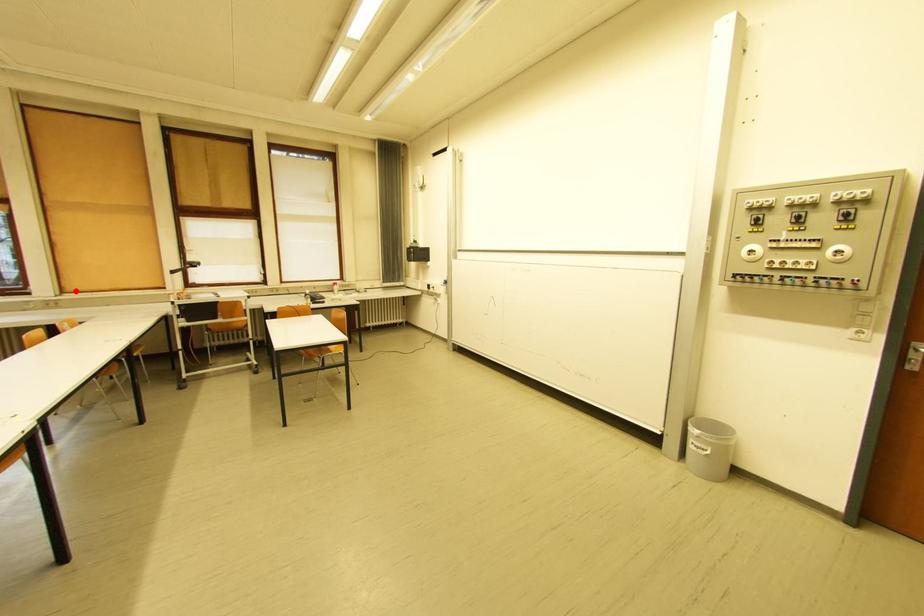
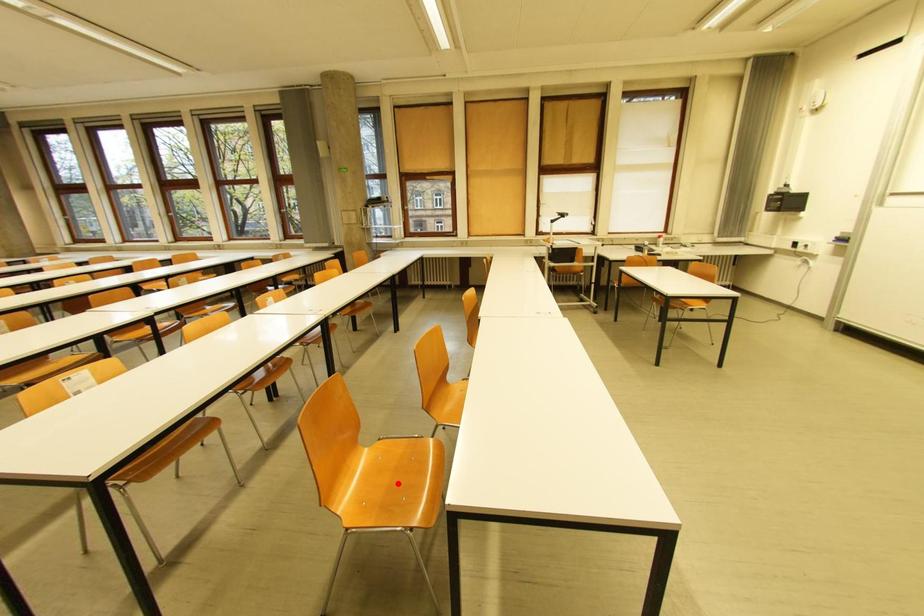
I am providing you with two images of the same scene from different viewpoints. A red point is marked on the first image and another point is marked on the second image. Is the marked point in image1 the same physical position as the marked point in image2?

No